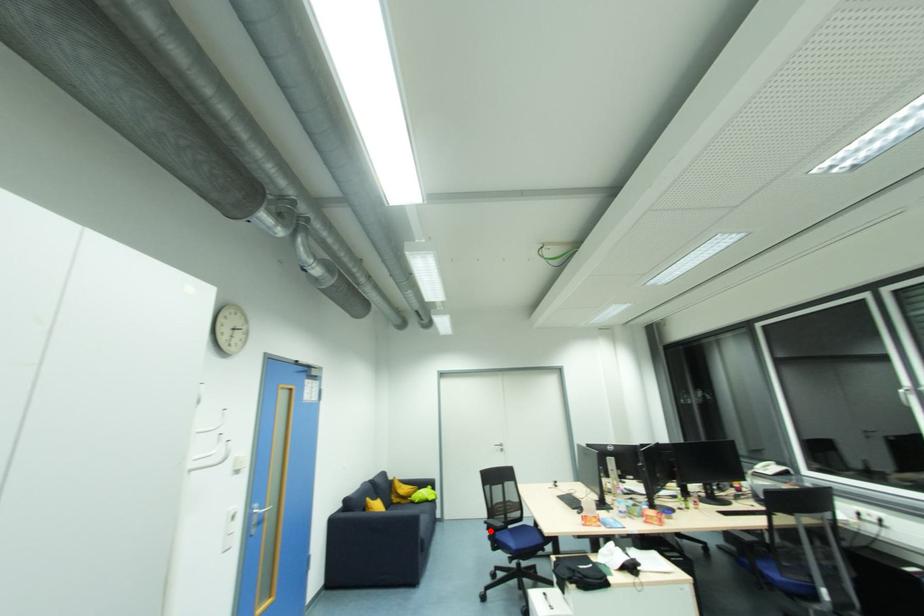
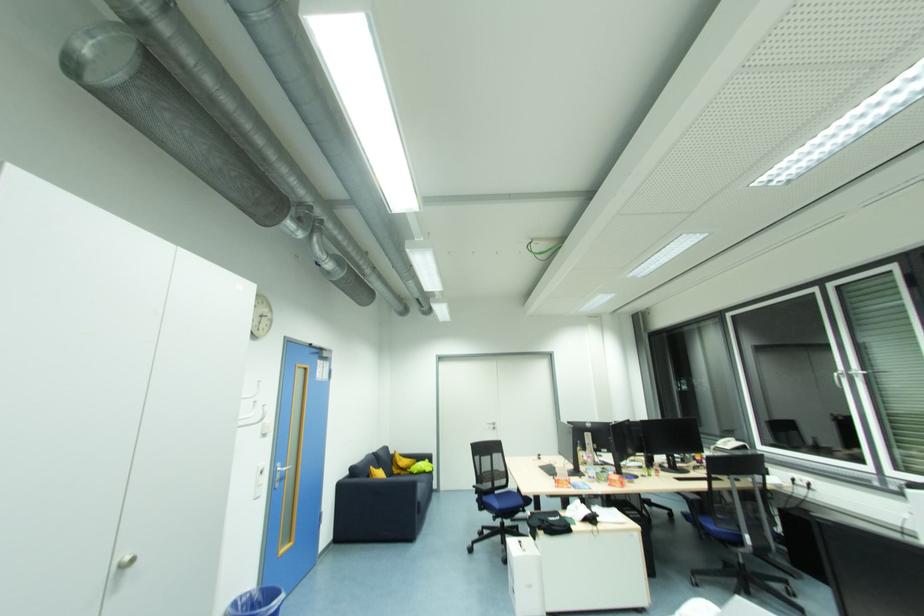
Question: I am providing you with two images of the same scene from different viewpoints. Given a red point in image1, look at the same physical point in image2. Is it:

Choices:
 (A) Closer to the viewpoint
 (B) Farther from the viewpoint

Answer: (B)